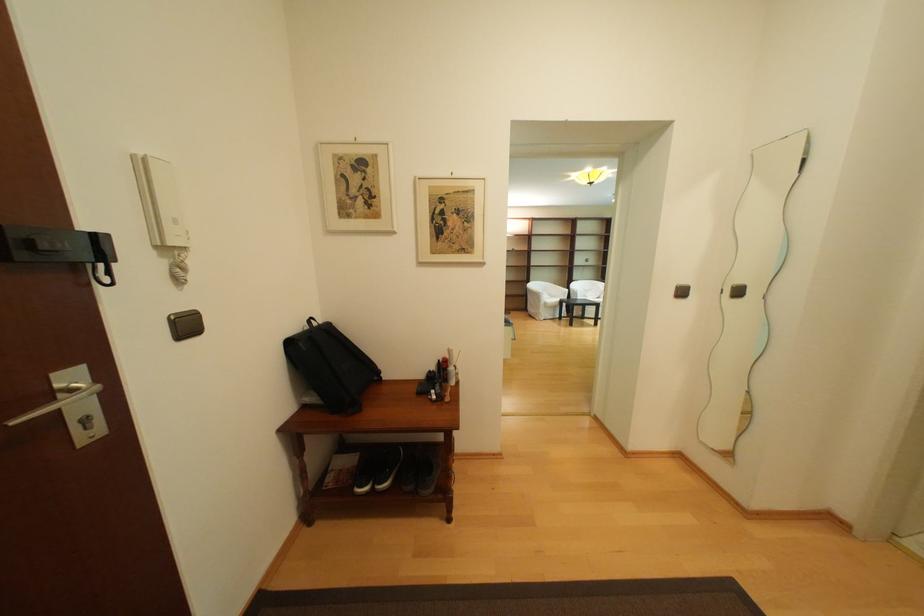
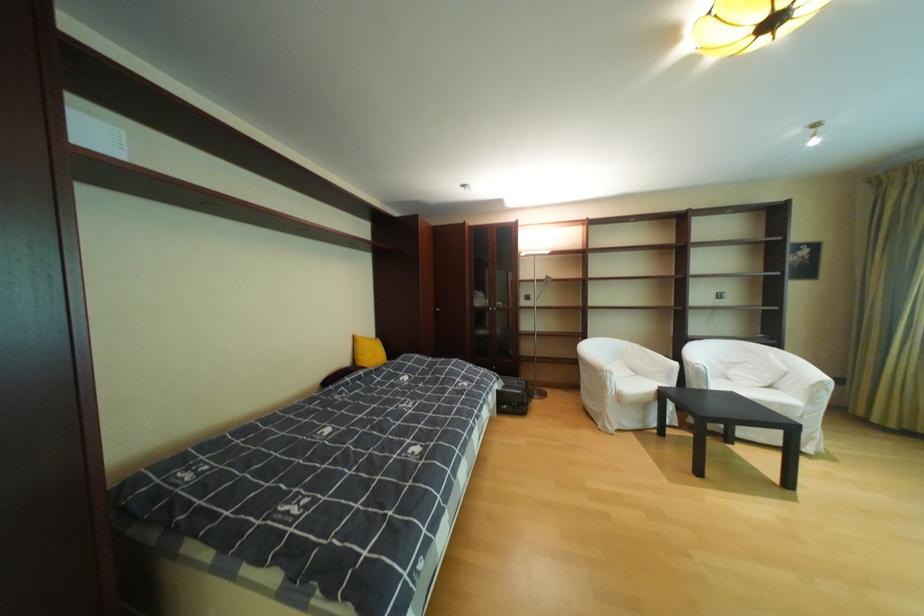
Find the pixel in the second image that matches point (553, 307) in the first image.

(621, 402)